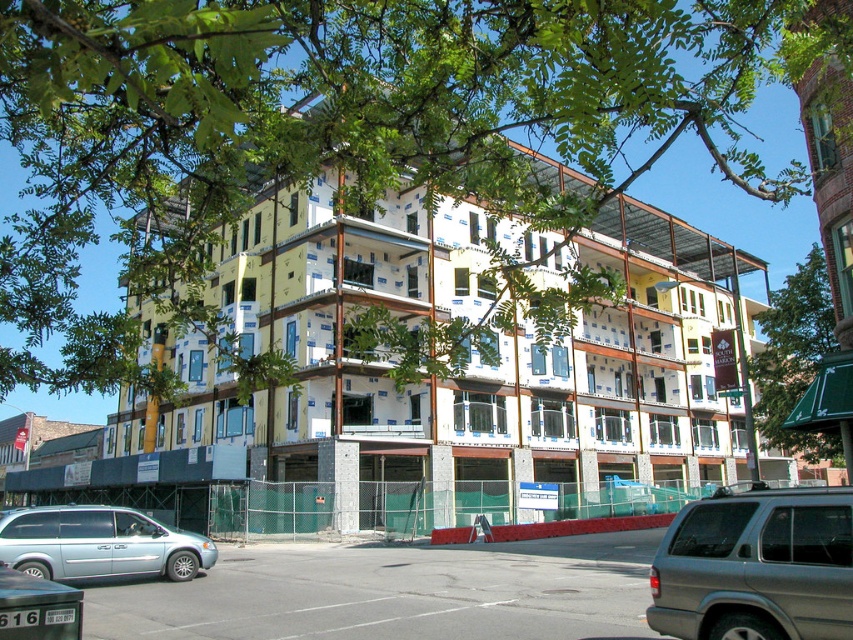
Question: Estimate the real-world distances between objects in this image. Which object is farther from the matte silver minivan at lower left?

Choices:
 (A) silver metallic suv at lower right
 (B) green leafy tree at upper center

Answer: (B)

Question: Estimate the real-world distances between objects in this image. Which object is farther from the yellow/white siding building at center?

Choices:
 (A) silver metallic suv at lower right
 (B) matte silver minivan at lower left
 (C) green leafy tree at upper center

Answer: (A)

Question: Does silver metallic suv at lower right have a lesser width compared to green leafy tree at upper center?

Choices:
 (A) yes
 (B) no

Answer: (A)

Question: Is yellow/white siding building at center closer to camera compared to green leafy tree at upper center?

Choices:
 (A) yes
 (B) no

Answer: (A)

Question: Is silver metallic suv at lower right positioned before matte silver minivan at lower left?

Choices:
 (A) yes
 (B) no

Answer: (A)

Question: Which point is farther to the camera?

Choices:
 (A) (712, 560)
 (B) (682, 278)
 (C) (33, 568)
 (D) (779, 404)

Answer: (B)